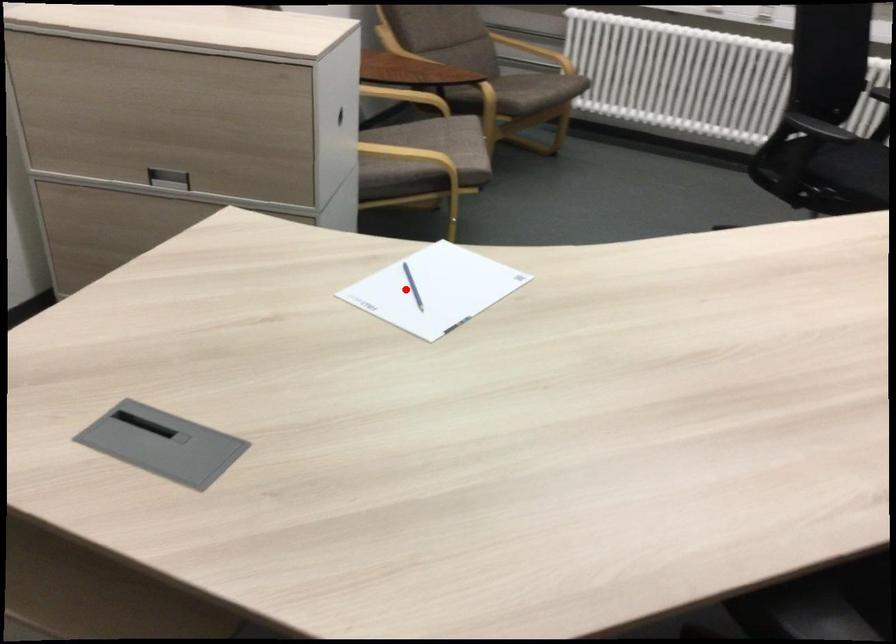
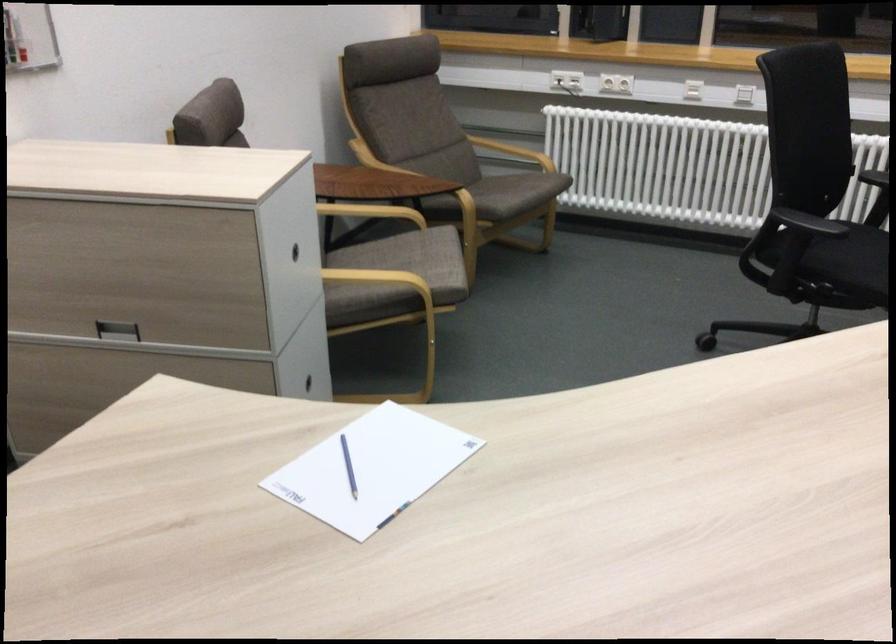
Question: A red point is marked in image1. In image2, is the corresponding 3D point closer to the camera or farther? Reply with the corresponding letter.

Choices:
 (A) The corresponding 3D point is closer.
 (B) The corresponding 3D point is farther.

Answer: (A)